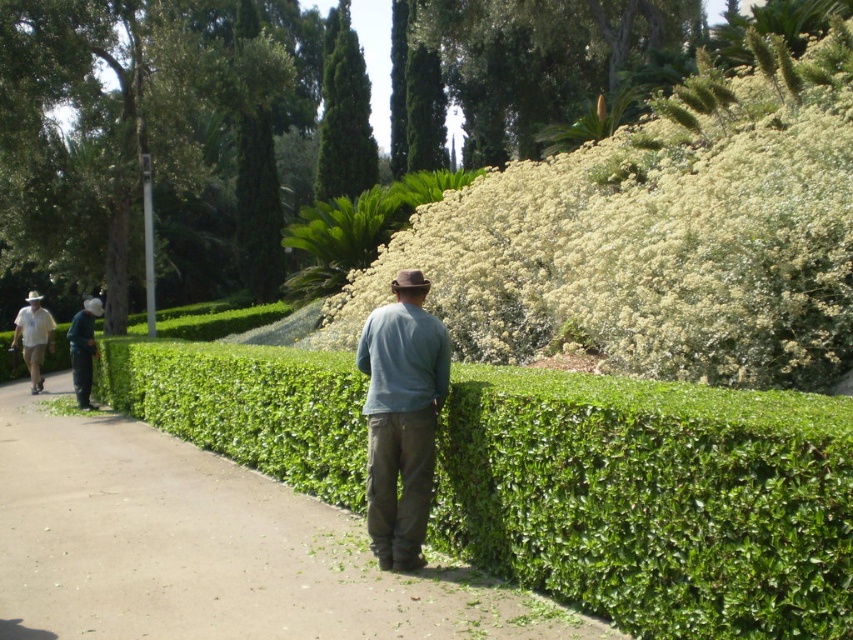
You are standing in the park and want to reach a specific location marked by the point at coordinates (769, 328). If you start walking directly towards it, how far will you have to walk in feet?

The point at coordinates (769, 328) is 22.15 feet away from the viewer, so you will have to walk 22.15 feet to reach it.

From the picture: You are a photographer planning to take a group photo of all the people in the scene. You want to ensure that everyone is visible in the photo. Given the positions and sizes of the green textured tree at upper center and dark blue jeans at left, which object should you position closer to the camera to avoid blocking others?

The dark blue jeans at left should be positioned closer to the camera since the green textured tree at upper center is larger and might block the view if placed in front.

You are a gardener who needs to place a new bench between the green textured tree at upper center and the dark blue jeans at left. Based on their widths, will the bench fit if it requires 1.2 meters of space?

The green textured tree at upper center might be wider than dark blue jeans at left, so the total width between them may be more than 1.2 meters. The bench should fit.